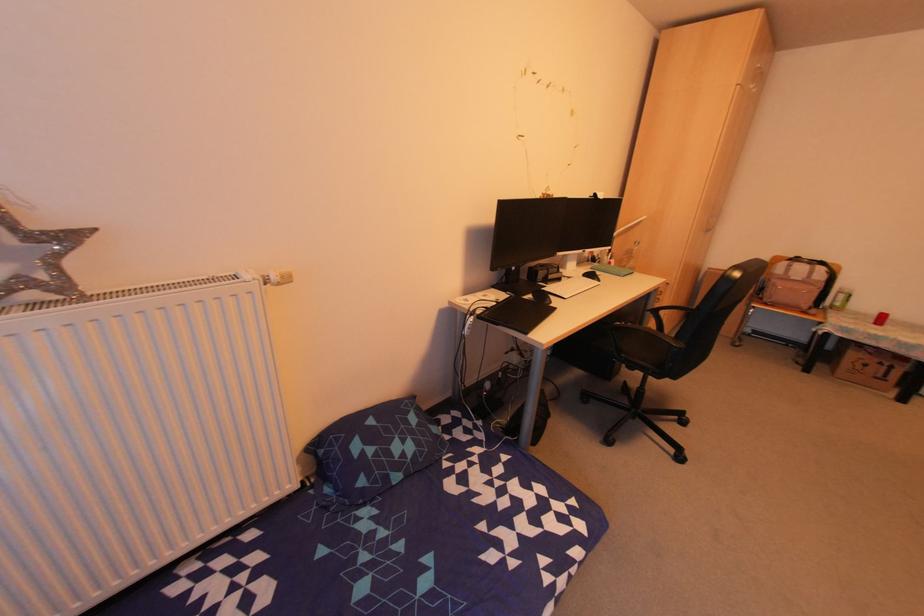
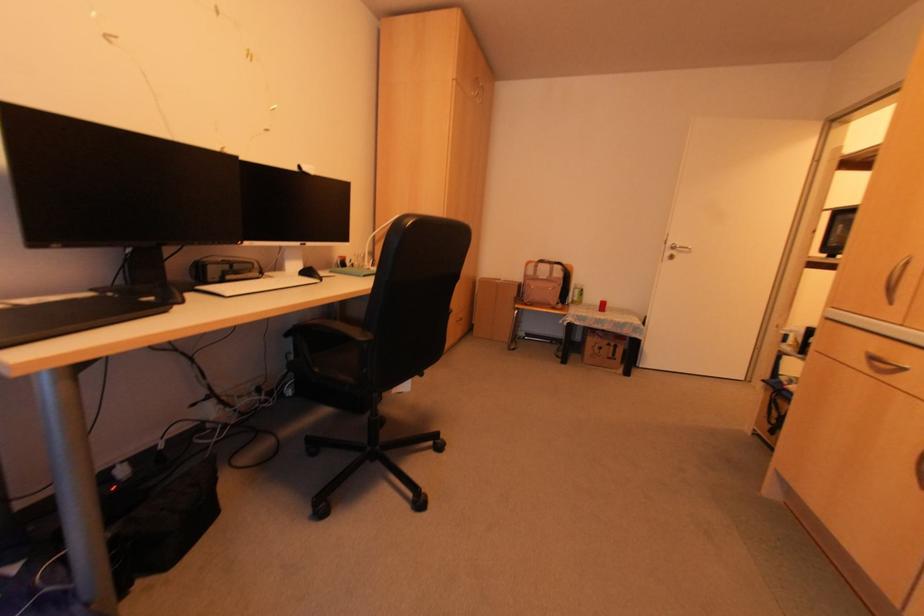
The point at [589,276] is marked in the first image. Where is the corresponding point in the second image?

(305, 274)